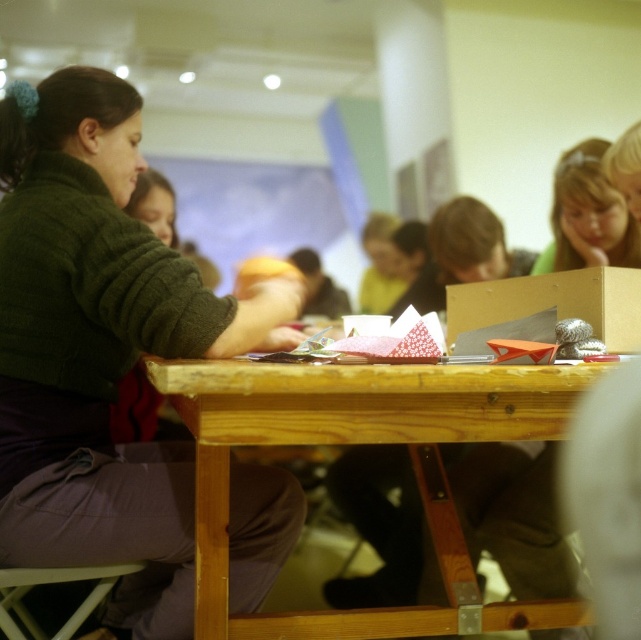
From the picture: You are standing at the back of the room and want to reach the wooden box at center. There is a wooden table at center in your way. Can you walk around the table to get to the box?

The wooden table at center is in front of the wooden box at center, so you can walk around the table to access the box.

You are a participant at the table and want to reach both the point at (638,253) and the point at (129,566). Which point will you need to reach first if you move towards them in order of proximity?

The point at (638,253) is closer to you than the point at (129,566), so you should reach it first.

You are standing in the room and want to see both the smooth skin face at upper right and the wooden stool at lower left. Which object should you look at first to see both without moving your head?

You should look at the smooth skin face at upper right first because it is above the wooden stool at lower left, so by looking at the higher position, you can see both objects in your field of view without moving your head.